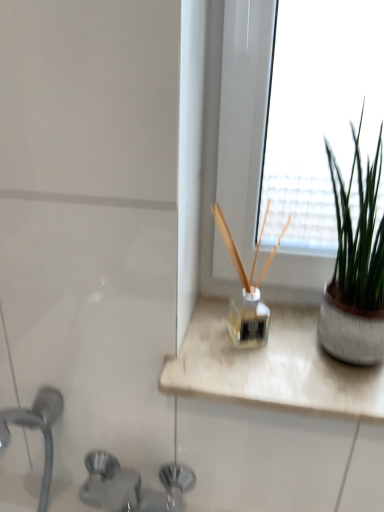
Question: Is green matte plant at right looking in the opposite direction of brushed metal faucet at lower left?

Choices:
 (A) no
 (B) yes

Answer: (A)

Question: Considering the relative sizes of green matte plant at right and brushed metal faucet at lower left in the image provided, is green matte plant at right bigger than brushed metal faucet at lower left?

Choices:
 (A) yes
 (B) no

Answer: (B)

Question: From a real-world perspective, is green matte plant at right positioned over brushed metal faucet at lower left based on gravity?

Choices:
 (A) no
 (B) yes

Answer: (B)

Question: Considering the relative positions of green matte plant at right and brushed metal faucet at lower left in the image provided, is green matte plant at right to the left of brushed metal faucet at lower left from the viewer's perspective?

Choices:
 (A) yes
 (B) no

Answer: (B)

Question: Can you confirm if green matte plant at right is shorter than brushed metal faucet at lower left?

Choices:
 (A) yes
 (B) no

Answer: (A)

Question: Does green matte plant at right touch brushed metal faucet at lower left?

Choices:
 (A) no
 (B) yes

Answer: (A)

Question: Does brushed metal faucet at lower left have a larger size compared to green matte plant at right?

Choices:
 (A) yes
 (B) no

Answer: (A)

Question: Is brushed metal faucet at lower left shorter than green matte plant at right?

Choices:
 (A) yes
 (B) no

Answer: (B)

Question: Is brushed metal faucet at lower left positioned beyond the bounds of green matte plant at right?

Choices:
 (A) yes
 (B) no

Answer: (A)

Question: Considering the relative positions of brushed metal faucet at lower left and green matte plant at right in the image provided, is brushed metal faucet at lower left to the right of green matte plant at right from the viewer's perspective?

Choices:
 (A) yes
 (B) no

Answer: (B)

Question: Does brushed metal faucet at lower left come behind green matte plant at right?

Choices:
 (A) yes
 (B) no

Answer: (B)

Question: From the image's perspective, is brushed metal faucet at lower left on green matte plant at right?

Choices:
 (A) no
 (B) yes

Answer: (A)

Question: From the image's perspective, relative to brushed metal faucet at lower left, is green matte plant at right above or below?

Choices:
 (A) above
 (B) below

Answer: (A)